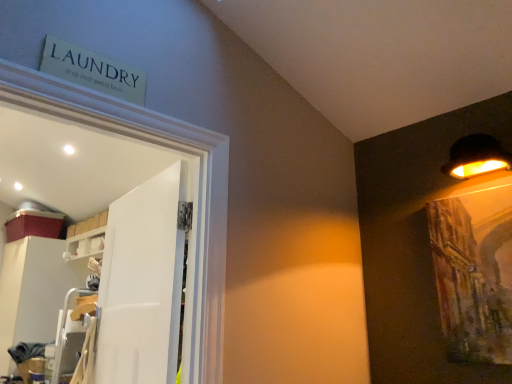
Image resolution: width=512 pixels, height=384 pixels. What do you see at coordinates (476, 157) in the screenshot? I see `black matte lampshade at upper right` at bounding box center [476, 157].

What is the approximate height of white glossy cabinet at left?

4.22 feet.

In order to face white glossy shelf at upper left, should I rotate leftwards or rightwards?

To face it directly, rotate left by 20.424 degrees.

This screenshot has height=384, width=512. Find the location of `white matte door at center`. white matte door at center is located at coordinates (143, 282).

Between black matte lampshade at upper right and white matte door at center, which one appears on the left side from the viewer's perspective?

white matte door at center.

Is there a large distance between black matte lampshade at upper right and white matte door at center?

black matte lampshade at upper right is positioned a significant distance from white matte door at center.

Is black matte lampshade at upper right aimed at white matte door at center?

No, black matte lampshade at upper right is not turned towards white matte door at center.

The image size is (512, 384). I want to click on door that is on the left side of black matte lampshade at upper right, so click(143, 282).

Could you tell me if white matte door at center is facing white glossy shelf at upper left?

No, white matte door at center is not facing towards white glossy shelf at upper left.

Is white matte door at center thinner than white glossy shelf at upper left?

Yes.

Considering the sizes of objects white matte door at center and white glossy shelf at upper left in the image provided, who is shorter, white matte door at center or white glossy shelf at upper left?

white glossy shelf at upper left.

Is there a large distance between white matte door at center and white glossy shelf at upper left?

That's right, there is a large distance between white matte door at center and white glossy shelf at upper left.

Can you confirm if white matte door at center is positioned to the left of white glossy cabinet at left?

In fact, white matte door at center is to the right of white glossy cabinet at left.

Between point (176, 345) and point (63, 285), which one is positioned in front?

The point (176, 345) is in front.

I want to click on door to the right of white glossy cabinet at left, so click(x=143, y=282).

Who is shorter, white matte door at center or white glossy cabinet at left?

white matte door at center is shorter.

Is white glossy cabinet at left positioned with its back to black matte lampshade at upper right?

No, white glossy cabinet at left is not facing the opposite direction of black matte lampshade at upper right.

Measure the distance from white glossy cabinet at left to black matte lampshade at upper right.

A distance of 3.42 meters exists between white glossy cabinet at left and black matte lampshade at upper right.

How many degrees apart are the facing directions of white glossy cabinet at left and black matte lampshade at upper right?

The angle between the facing direction of white glossy cabinet at left and the facing direction of black matte lampshade at upper right is 3.43 degrees.

Is white glossy cabinet at left not near black matte lampshade at upper right?

Yes.

Who is bigger, white glossy shelf at upper left or white matte door at center?

Bigger between the two is white matte door at center.

Considering the relative sizes of white glossy shelf at upper left and white matte door at center in the image provided, is white glossy shelf at upper left wider than white matte door at center?

Indeed, white glossy shelf at upper left has a greater width compared to white matte door at center.

In the scene shown: Is white glossy shelf at upper left facing away from white matte door at center?

white glossy shelf at upper left is not turned away from white matte door at center.

Could white matte door at center be considered to be inside white glossy shelf at upper left?

No, white glossy shelf at upper left does not contain white matte door at center.

Considering the positions of objects white matte door at center and black matte lampshade at upper right in the image provided, who is more to the right, white matte door at center or black matte lampshade at upper right?

black matte lampshade at upper right is more to the right.

From a real-world perspective, is white matte door at center physically below black matte lampshade at upper right?

Correct, in the physical world, white matte door at center is lower than black matte lampshade at upper right.

Is white matte door at center with black matte lampshade at upper right?

No, white matte door at center is not with black matte lampshade at upper right.

From a real-world perspective, does white glossy shelf at upper left sit lower than white glossy cabinet at left?

No, from a real-world perspective, white glossy shelf at upper left is not beneath white glossy cabinet at left.

Can you confirm if white glossy shelf at upper left is positioned to the right of white glossy cabinet at left?

Indeed, white glossy shelf at upper left is positioned on the right side of white glossy cabinet at left.

Based on the photo, from the image's perspective, would you say white glossy shelf at upper left is shown under white glossy cabinet at left?

No.

What are the coordinates of `door lying below the black matte lampshade at upper right (from the image's perspective)` in the screenshot? It's located at (143, 282).

I want to click on shelf behind the white matte door at center, so click(85, 245).

From the image, which object appears to be nearer to white glossy shelf at upper left, white glossy cabinet at left or white matte door at center?

Based on the image, white glossy cabinet at left appears to be nearer to white glossy shelf at upper left.

From the image, which object appears to be farther from black matte lampshade at upper right, white glossy shelf at upper left or white glossy cabinet at left?

white glossy cabinet at left.

Based on their spatial positions, is black matte lampshade at upper right or white glossy cabinet at left further from white matte door at center?

white glossy cabinet at left is positioned further to the anchor white matte door at center.

Estimate the real-world distances between objects in this image. Which object is further from white glossy shelf at upper left, white matte door at center or black matte lampshade at upper right?

The object further to white glossy shelf at upper left is black matte lampshade at upper right.

In the scene shown: Looking at the image, which one is located closer to white glossy cabinet at left, white glossy shelf at upper left or black matte lampshade at upper right?

white glossy shelf at upper left is positioned closer to the anchor white glossy cabinet at left.

Estimate the real-world distances between objects in this image. Which object is further from white glossy shelf at upper left, white glossy cabinet at left or black matte lampshade at upper right?

Among the two, black matte lampshade at upper right is located further to white glossy shelf at upper left.

When comparing their distances from white glossy shelf at upper left, does white matte door at center or white glossy cabinet at left seem further?

white matte door at center is further to white glossy shelf at upper left.

Considering their positions, is black matte lampshade at upper right positioned closer to white glossy shelf at upper left than white glossy cabinet at left?

The object closer to white glossy shelf at upper left is white glossy cabinet at left.

Identify the location of cabinetry between white matte door at center and white glossy shelf at upper left along the z-axis. This screenshot has height=384, width=512. (33, 292).

Identify the location of lamp located between white matte door at center and white glossy shelf at upper left in the depth direction. (476, 157).

Locate an element on the screen. The width and height of the screenshot is (512, 384). door located between white glossy cabinet at left and black matte lampshade at upper right in the left-right direction is located at coordinates (143, 282).

Find the location of a particular element. shelf between white glossy cabinet at left and black matte lampshade at upper right is located at coordinates (85, 245).